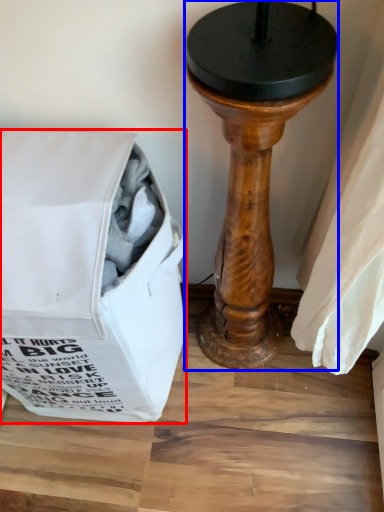
Question: Which object appears closest to the camera in this image, bag (highlighted by a red box) or furniture (highlighted by a blue box)?

Choices:
 (A) bag
 (B) furniture

Answer: (B)